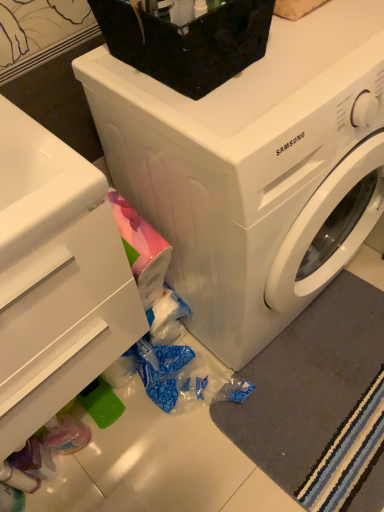
This screenshot has width=384, height=512. I want to click on white glossy drawer at lower left, so click(x=63, y=322).

What do you see at coordinates (309, 386) in the screenshot?
I see `gray soft rug at lower right` at bounding box center [309, 386].

The image size is (384, 512). What are the coordinates of `gray soft rug at lower right` in the screenshot? It's located at (309, 386).

Locate an element on the screen. This screenshot has height=512, width=384. white glossy washing machine at center is located at coordinates (254, 170).

Locate an element on the screen. white glossy drawer at lower left is located at coordinates (63, 322).

Does white glossy washing machine at center turn towards gray soft rug at lower right?

Yes, white glossy washing machine at center is facing gray soft rug at lower right.

Where is `washing machine that is in front of the gray soft rug at lower right`? The image size is (384, 512). washing machine that is in front of the gray soft rug at lower right is located at coordinates (254, 170).

Is white glossy washing machine at center thinner than gray soft rug at lower right?

No.

Does point (282, 206) appear closer or farther from the camera than point (275, 430)?

Point (282, 206) is closer to the camera than point (275, 430).

Between point (132, 32) and point (270, 323), which one is positioned behind?

The point (270, 323) is farther from the camera.

From the image's perspective, which is below, black plastic container at upper center or white glossy washing machine at center?

From the image's view, white glossy washing machine at center is below.

Considering the relative sizes of black plastic container at upper center and white glossy washing machine at center in the image provided, is black plastic container at upper center shorter than white glossy washing machine at center?

Yes.

Is black plastic container at upper center not near white glossy washing machine at center?

black plastic container at upper center is near white glossy washing machine at center, not far away.

Does gray soft rug at lower right touch white glossy washing machine at center?

No.

From the image's perspective, between gray soft rug at lower right and white glossy washing machine at center, which one is located above?

From the image's view, white glossy washing machine at center is above.

How many degrees apart are the facing directions of gray soft rug at lower right and white glossy washing machine at center?

The angular difference between gray soft rug at lower right and white glossy washing machine at center is 4.14 degrees.

From the picture: Which is less distant, (371,356) or (131,37)?

Positioned in front is point (131,37).

Does gray soft rug at lower right turn towards black plastic container at upper center?

No.

Can you confirm if gray soft rug at lower right is thinner than black plastic container at upper center?

In fact, gray soft rug at lower right might be wider than black plastic container at upper center.

From a real-world perspective, which is physically above, gray soft rug at lower right or black plastic container at upper center?

black plastic container at upper center is physically above.

In the scene shown: Is white glossy washing machine at center shorter than black plastic container at upper center?

No.

Can you tell me how much white glossy washing machine at center and black plastic container at upper center differ in facing direction?

They differ by 0.000329 degrees in their facing directions.

Is white glossy washing machine at center not close to black plastic container at upper center?

That's not correct — white glossy washing machine at center is a little close to black plastic container at upper center.

Which of these two, white glossy washing machine at center or black plastic container at upper center, is wider?

white glossy washing machine at center.

From the image's perspective, which one is positioned higher, white glossy drawer at lower left or black plastic container at upper center?

black plastic container at upper center is shown above in the image.

The height and width of the screenshot is (512, 384). What are the coordinates of `appliance above the white glossy drawer at lower left (from the image's perspective)` in the screenshot? It's located at (187, 42).

Measure the distance from white glossy drawer at lower left to black plastic container at upper center.

They are 17.28 inches apart.

Considering the relative positions of white glossy drawer at lower left and black plastic container at upper center in the image provided, is white glossy drawer at lower left to the left of black plastic container at upper center from the viewer's perspective?

Yes, white glossy drawer at lower left is to the left of black plastic container at upper center.

Looking at this image, would you say black plastic container at upper center is outside white glossy drawer at lower left?

black plastic container at upper center is positioned outside white glossy drawer at lower left.

You are a GUI agent. You are given a task and a screenshot of the screen. Output one action in this format:
    pyautogui.click(x=<x>, y=<y>)
    Task: Click on the appliance behind the white glossy drawer at lower left
    The image size is (384, 512).
    Given the screenshot: What is the action you would take?
    pyautogui.click(x=187, y=42)

How many degrees apart are the facing directions of black plastic container at upper center and white glossy drawer at lower left?

black plastic container at upper center and white glossy drawer at lower left are facing 1.2 degrees away from each other.

Consider the image. Between black plastic container at upper center and white glossy drawer at lower left, which one is positioned behind?

black plastic container at upper center is further away from the camera.

The height and width of the screenshot is (512, 384). Find the location of `washing machine above the gray soft rug at lower right (from the image's perspective)`. washing machine above the gray soft rug at lower right (from the image's perspective) is located at coordinates (254, 170).

Locate an element on the screen. washing machine below the black plastic container at upper center (from a real-world perspective) is located at coordinates (254, 170).

From the image, which object appears to be farther from black plastic container at upper center, white glossy washing machine at center or white glossy drawer at lower left?

white glossy drawer at lower left is further to black plastic container at upper center.

Estimate the real-world distances between objects in this image. Which object is closer to white glossy drawer at lower left, black plastic container at upper center or gray soft rug at lower right?

black plastic container at upper center lies closer to white glossy drawer at lower left than the other object.

Looking at the image, which one is located closer to gray soft rug at lower right, white glossy drawer at lower left or black plastic container at upper center?

white glossy drawer at lower left is closer to gray soft rug at lower right.

Based on their spatial positions, is gray soft rug at lower right or black plastic container at upper center closer to white glossy washing machine at center?

black plastic container at upper center.

Estimate the real-world distances between objects in this image. Which object is closer to white glossy drawer at lower left, white glossy washing machine at center or black plastic container at upper center?

Based on the image, white glossy washing machine at center appears to be nearer to white glossy drawer at lower left.

Based on their spatial positions, is gray soft rug at lower right or black plastic container at upper center further from white glossy drawer at lower left?

The object further to white glossy drawer at lower left is gray soft rug at lower right.

Based on their spatial positions, is gray soft rug at lower right or white glossy drawer at lower left closer to white glossy washing machine at center?

white glossy drawer at lower left lies closer to white glossy washing machine at center than the other object.

Consider the image. Which object lies further to the anchor point gray soft rug at lower right, white glossy washing machine at center or black plastic container at upper center?

black plastic container at upper center is positioned further to the anchor gray soft rug at lower right.

Find the location of a particular element. washing machine between black plastic container at upper center and gray soft rug at lower right in the vertical direction is located at coordinates (254, 170).

Locate an element on the screen. The image size is (384, 512). appliance located between white glossy drawer at lower left and gray soft rug at lower right in the left-right direction is located at coordinates (x=187, y=42).

Locate an element on the screen. The image size is (384, 512). appliance between white glossy drawer at lower left and white glossy washing machine at center in the horizontal direction is located at coordinates (187, 42).

Where is `washing machine located between white glossy drawer at lower left and gray soft rug at lower right in the left-right direction`? washing machine located between white glossy drawer at lower left and gray soft rug at lower right in the left-right direction is located at coordinates (254, 170).